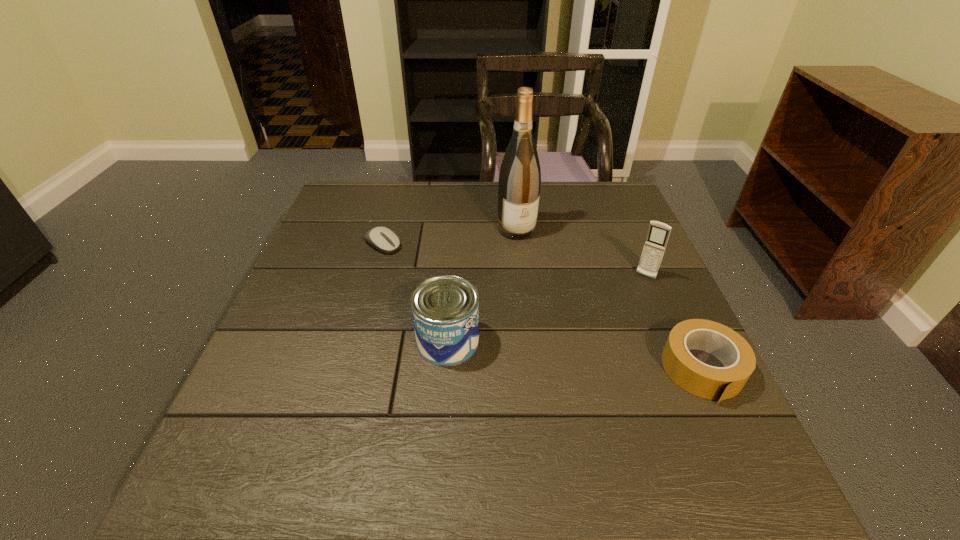
Image resolution: width=960 pixels, height=540 pixels. Find the location of `the third tallest object`. the third tallest object is located at coordinates (445, 309).

Locate an element on the screen. The width and height of the screenshot is (960, 540). the second object from left to right is located at coordinates (445, 309).

At what (x,y) coordinates should I click in order to perform the action: click on the fourth tallest object. Please return your answer as a coordinate pair (x, y). Looking at the image, I should click on (713, 383).

At what (x,y) coordinates should I click in order to perform the action: click on the second tallest object. Please return your answer as a coordinate pair (x, y). The image size is (960, 540). Looking at the image, I should click on (658, 234).

What are the coordinates of `cellular telephone` in the screenshot? It's located at (658, 234).

I want to click on the tallest object, so click(x=519, y=184).

Where is `wine bottle`? The image size is (960, 540). wine bottle is located at coordinates (519, 184).

Where is `computer equipment`? Image resolution: width=960 pixels, height=540 pixels. computer equipment is located at coordinates (382, 239).

Where is `the shortest object`? the shortest object is located at coordinates coord(382,239).

Find the location of a particular element. The width and height of the screenshot is (960, 540). vacant space situated on the front label of the second object from left to right is located at coordinates (605, 341).